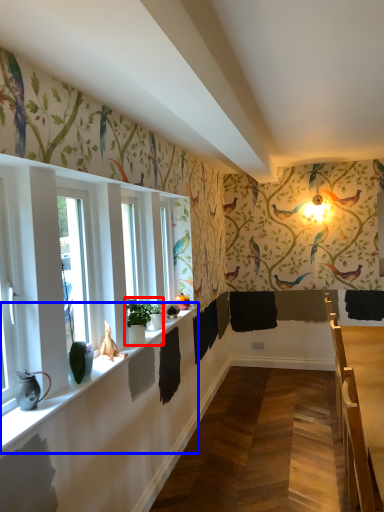
Question: Which object appears closest to the camera in this image, houseplant (highlighted by a red box) or window sill (highlighted by a blue box)?

Choices:
 (A) houseplant
 (B) window sill

Answer: (B)